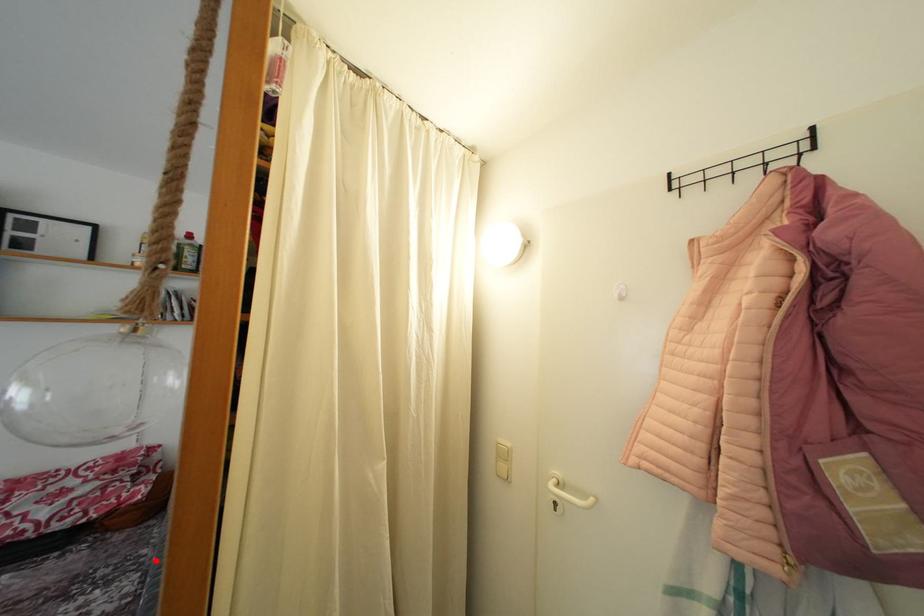
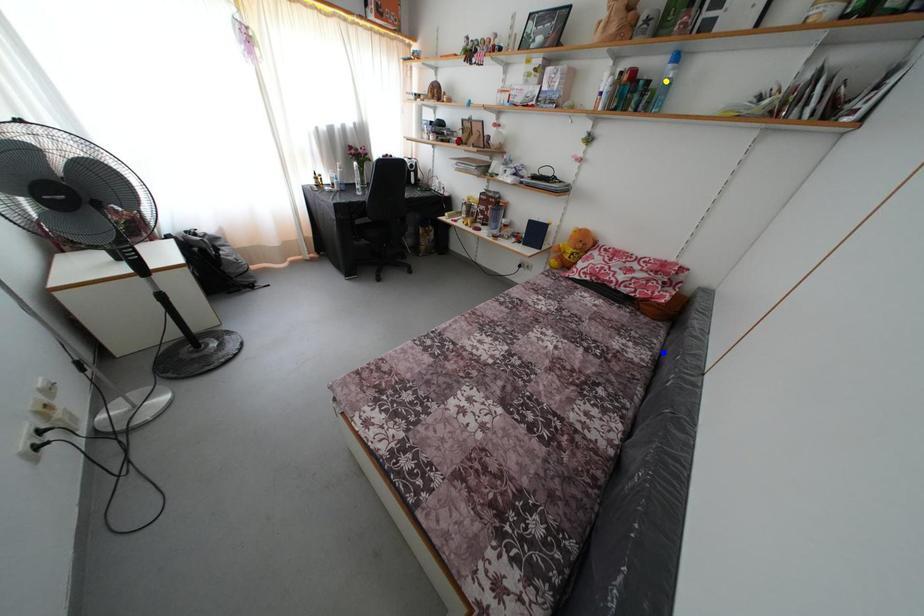
Question: I am providing you with two images of the same scene from different viewpoints. A red point is marked on the first image. You are given multiple points on the second image. Can you choose the point in image 2 that corresponds to the point in image 1?

Choices:
 (A) green point
 (B) blue point
 (C) yellow point

Answer: (B)